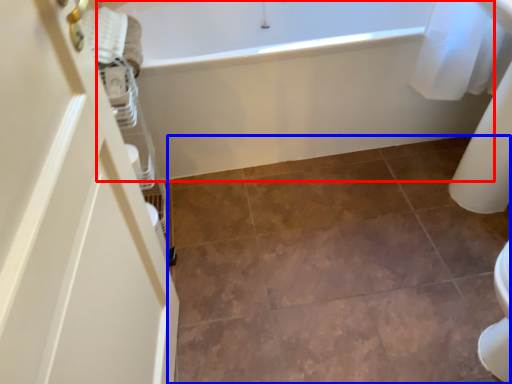
Question: Which point is further to the camera, bathtub (highlighted by a red box) or ceramic tile (highlighted by a blue box)?

Choices:
 (A) bathtub
 (B) ceramic tile

Answer: (A)